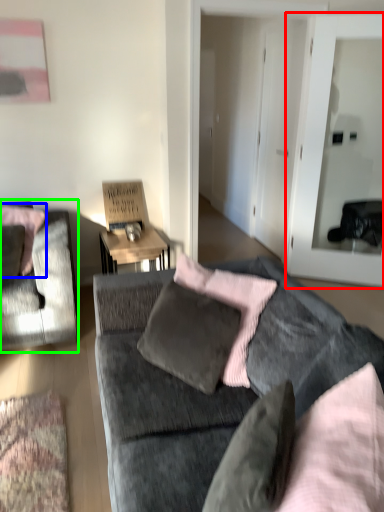
Question: Based on their relative distances, which object is farther from glass door (highlighted by a red box)? Choose from pillow (highlighted by a blue box) and chair (highlighted by a green box).

Choices:
 (A) pillow
 (B) chair

Answer: (A)